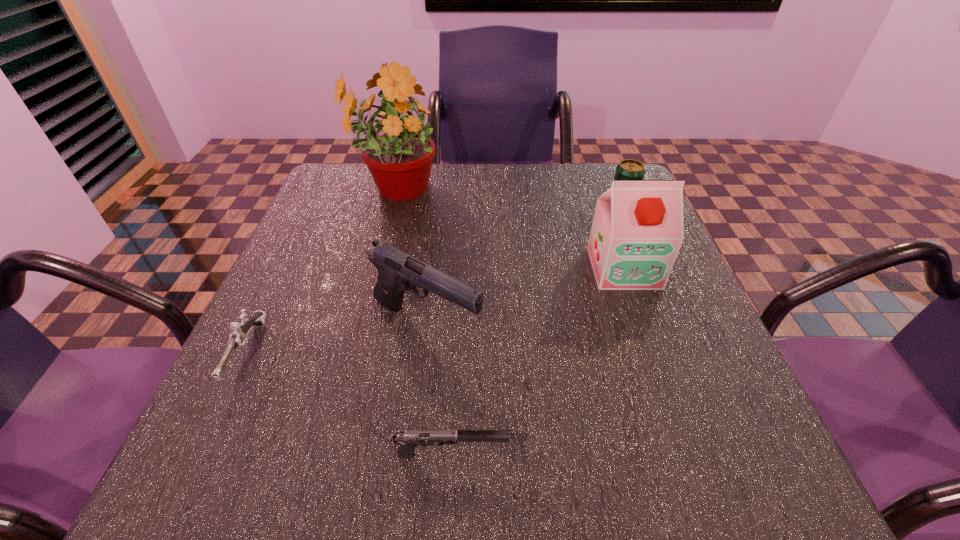
Where is `flowerpot`? The width and height of the screenshot is (960, 540). flowerpot is located at coordinates (399, 154).

Where is `the fourth nearest object`? Image resolution: width=960 pixels, height=540 pixels. the fourth nearest object is located at coordinates (637, 231).

You are a GUI agent. You are given a task and a screenshot of the screen. Output one action in this format:
    pyautogui.click(x=<x>, y=<y>)
    Task: Click on the fifth shortest object
    Image resolution: width=960 pixels, height=540 pixels.
    Given the screenshot: What is the action you would take?
    pyautogui.click(x=637, y=231)

In order to click on the tallest gun in this screenshot , I will do `click(398, 272)`.

Where is `the fourth tallest object`? The image size is (960, 540). the fourth tallest object is located at coordinates (628, 169).

You are a GUI agent. You are given a task and a screenshot of the screen. Output one action in this format:
    pyautogui.click(x=<x>, y=<y>)
    Task: Click on the leftmost gun
    The height and width of the screenshot is (540, 960).
    Given the screenshot: What is the action you would take?
    pyautogui.click(x=238, y=337)

At what (x,y) coordinates should I click in order to perform the action: click on the nearest object. Please return your answer as a coordinate pair (x, y). Looking at the image, I should click on (407, 440).

At what (x,y) coordinates should I click in order to perform the action: click on vacant space located on the front of the flowerpot. Please return your answer as a coordinate pair (x, y). The image size is (960, 540). Looking at the image, I should click on (368, 289).

You are a GUI agent. You are given a task and a screenshot of the screen. Output one action in this format:
    pyautogui.click(x=<x>, y=<y>)
    Task: Click on the vacant space located with the cap open on the fourth nearest object
    The height and width of the screenshot is (540, 960).
    Given the screenshot: What is the action you would take?
    pyautogui.click(x=648, y=336)

Image resolution: width=960 pixels, height=540 pixels. Identify the location of vacant region located 0.390m at the muzzle of the fourth shortest object. (693, 326).